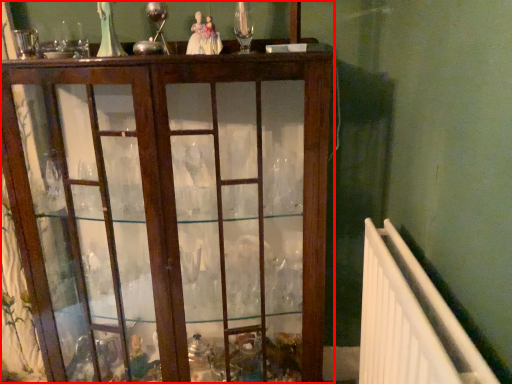
Question: From the image, what is the correct spatial relationship of furniture (annotated by the red box) in relation to radiator?

Choices:
 (A) left
 (B) right

Answer: (A)